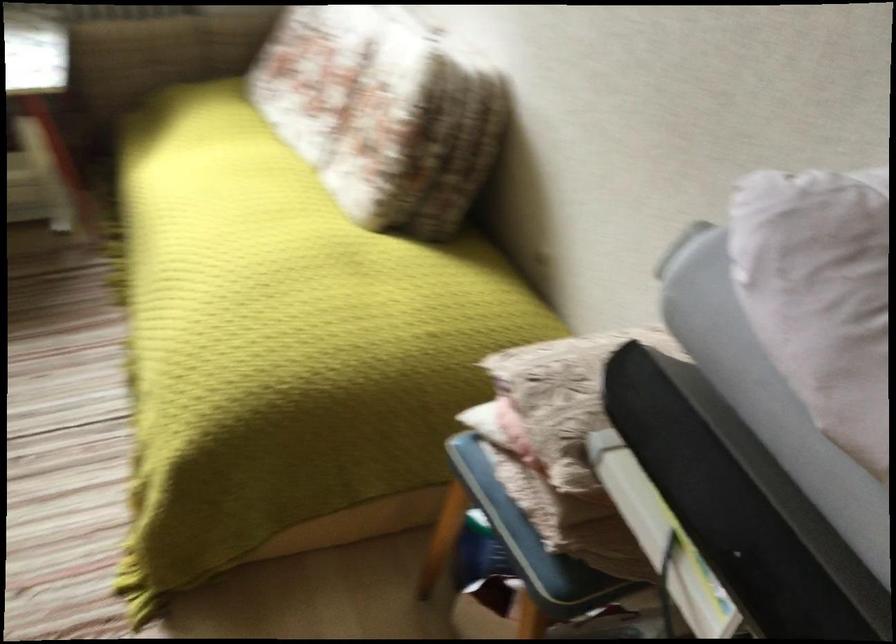
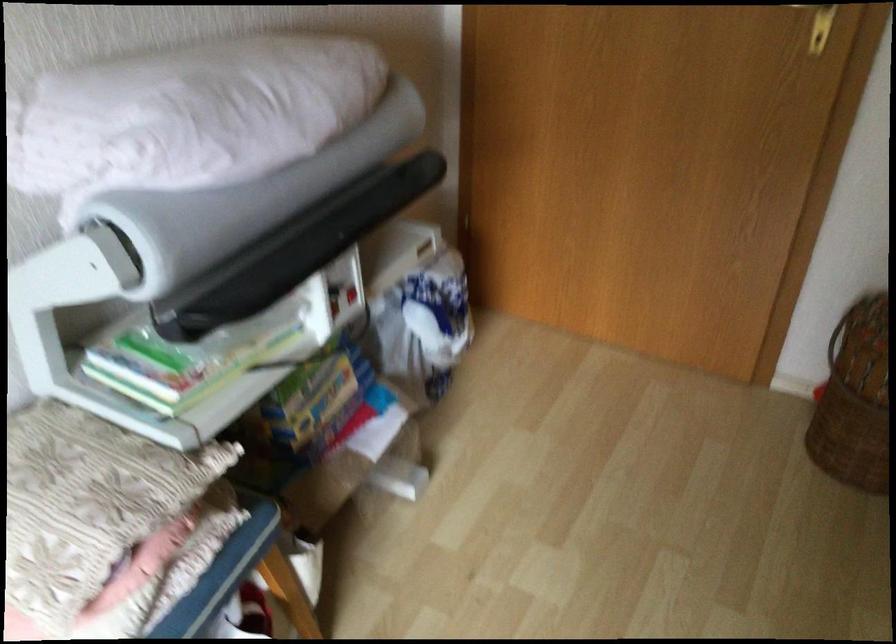
In the second image, find the point that corresponds to point (513, 513) in the first image.

(222, 572)